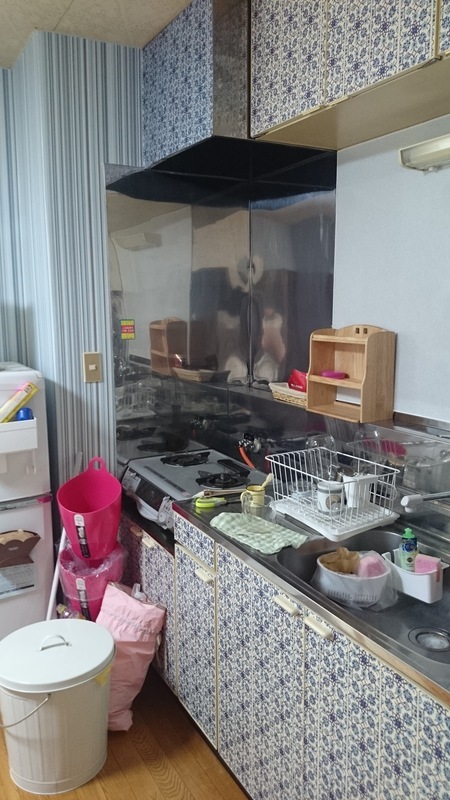
You are a GUI agent. You are given a task and a screenshot of the screen. Output one action in this format:
    pyautogui.click(x=<x>, y=<y>)
    Task: Click on the stove burner
    This screenshot has width=450, height=800.
    Given the screenshot: What is the action you would take?
    pyautogui.click(x=190, y=458), pyautogui.click(x=212, y=484)